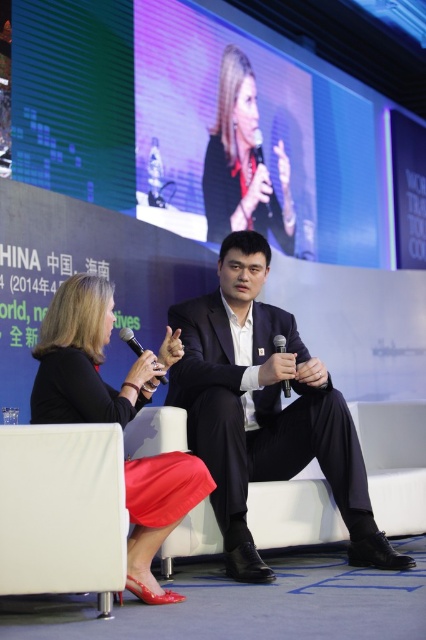
Is dark blue suit at center positioned behind white fabric chair at lower left?

Yes.

Between dark blue suit at center and white fabric chair at lower left, which one is positioned higher?

dark blue suit at center

The height and width of the screenshot is (640, 426). What do you see at coordinates (264, 410) in the screenshot?
I see `dark blue suit at center` at bounding box center [264, 410].

Find the location of a particular element. The width and height of the screenshot is (426, 640). dark blue suit at center is located at coordinates (264, 410).

Does white fabric chair at lower left appear over matte black dress at center?

No.

Between white fabric chair at lower left and matte black dress at center, which one is positioned higher?

matte black dress at center is above.

Is point (42, 547) closer to camera compared to point (134, 483)?

Yes.

The image size is (426, 640). What are the coordinates of `white fabric chair at lower left` in the screenshot? It's located at (63, 509).

Is white fabric chair at lower left bigger than matte black jacket at upper center?

Incorrect, white fabric chair at lower left is not larger than matte black jacket at upper center.

Does white fabric chair at lower left lie behind matte black jacket at upper center?

That is False.

Where is `white fabric chair at lower left`? white fabric chair at lower left is located at coordinates (63, 509).